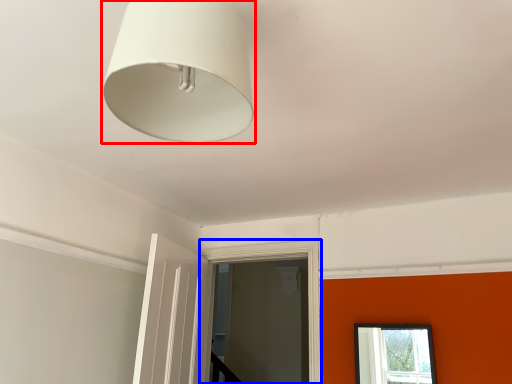
Question: Among these objects, which one is nearest to the camera, lamp (highlighted by a red box) or window frame (highlighted by a blue box)?

Choices:
 (A) lamp
 (B) window frame

Answer: (A)